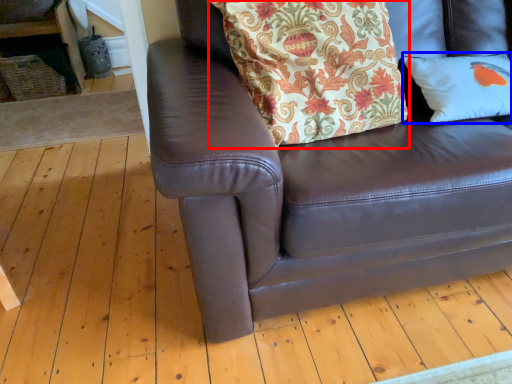
Question: Among these objects, which one is nearest to the camera, blanket (highlighted by a red box) or pillow (highlighted by a blue box)?

Choices:
 (A) blanket
 (B) pillow

Answer: (A)